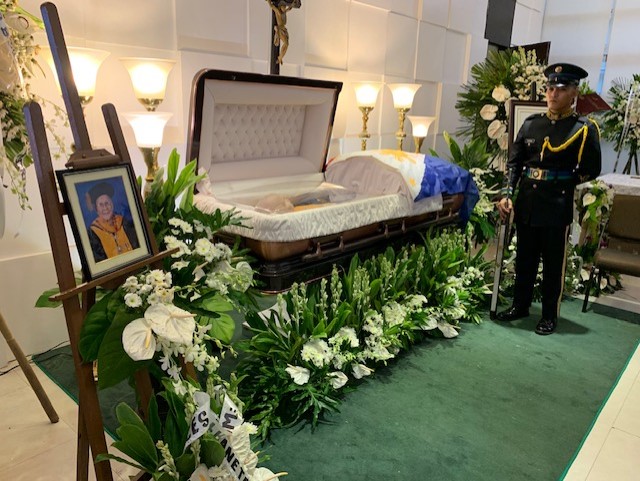
In order to click on rug in this screenshot , I will do `click(497, 410)`.